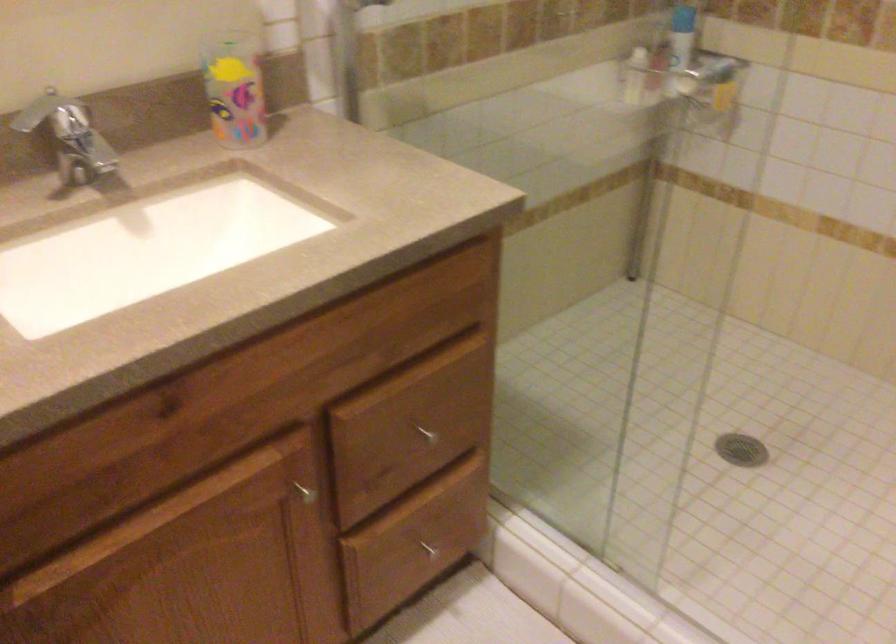
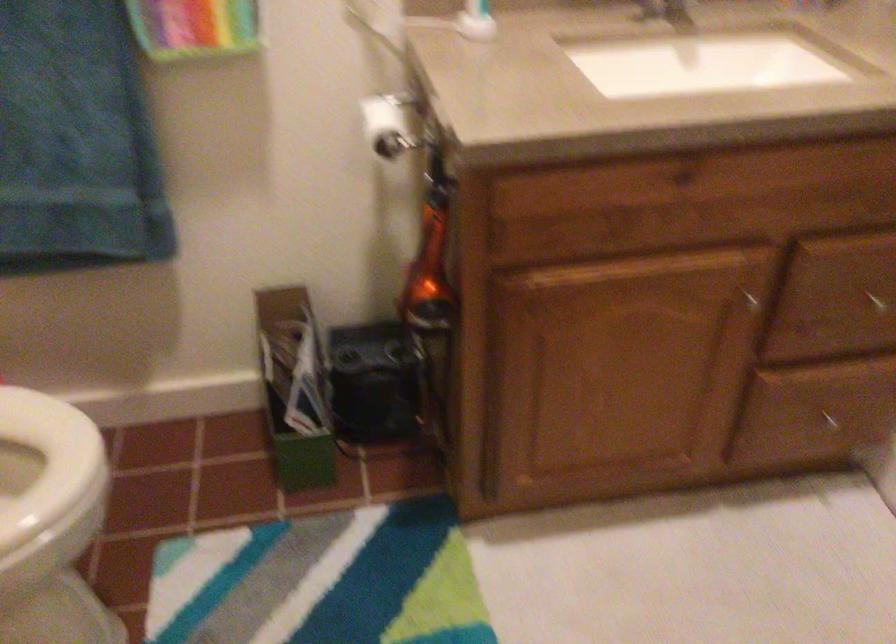
Where in the second image is the point corresponding to [303,471] from the first image?

(752, 285)